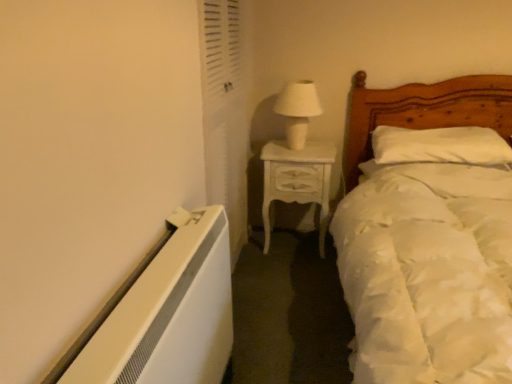
You are a GUI agent. You are given a task and a screenshot of the screen. Output one action in this format:
    pyautogui.click(x=<x>, y=<y>)
    Task: Click on the white glossy nightstand at center
    
    Given the screenshot: What is the action you would take?
    point(297,181)

Identify the location of white soft pillow at center. (440, 146).

At what (x,y) coordinates should I click in order to perform the action: click on white glossy nightstand at center. Please return your answer as a coordinate pair (x, y). Looking at the image, I should click on (297, 181).

Is white textured screen door at upper left to the right of white glossy nightstand at center from the viewer's perspective?

No, white textured screen door at upper left is not to the right of white glossy nightstand at center.

Consider the image. Would you say white textured screen door at upper left is inside or outside white glossy nightstand at center?

white textured screen door at upper left exists outside the volume of white glossy nightstand at center.

Which of these two, white textured screen door at upper left or white glossy nightstand at center, stands taller?

white textured screen door at upper left is taller.

At what (x,y) coordinates should I click in order to perform the action: click on nightstand on the right of white textured screen door at upper left. Please return your answer as a coordinate pair (x, y). The image size is (512, 384). Looking at the image, I should click on (297, 181).

Between white glossy nightstand at center and white textured screen door at upper left, which one has more height?

Standing taller between the two is white textured screen door at upper left.

Based on their sizes in the image, would you say white glossy nightstand at center is bigger or smaller than white textured screen door at upper left?

white glossy nightstand at center is bigger than white textured screen door at upper left.

Is white glossy nightstand at center closer to the viewer compared to white textured screen door at upper left?

No, the depth of white glossy nightstand at center is greater than that of white textured screen door at upper left.

Based on the photo, how different are the orientations of white glossy nightstand at center and white textured screen door at upper left in degrees?

88.4 degrees separate the facing orientations of white glossy nightstand at center and white textured screen door at upper left.

In the scene shown: Can you confirm if white textured screen door at upper left is wider than white soft pillow at center?

Incorrect, the width of white textured screen door at upper left does not surpass that of white soft pillow at center.

How different are the orientations of white textured screen door at upper left and white soft pillow at center in degrees?

89.2 degrees separate the facing orientations of white textured screen door at upper left and white soft pillow at center.

Is white textured screen door at upper left to the left or to the right of white soft pillow at center in the image?

From the image, it's evident that white textured screen door at upper left is to the left of white soft pillow at center.

Is white textured screen door at upper left outside of white soft pillow at center?

white textured screen door at upper left lies outside white soft pillow at center's area.

Is white satin bed at right at the back of white textured screen door at upper left?

No, white textured screen door at upper left is not facing the opposite direction of white satin bed at right.

From the image's perspective, which one is positioned higher, white textured screen door at upper left or white satin bed at right?

white textured screen door at upper left, from the image's perspective.

Does white textured screen door at upper left appear on the right side of white satin bed at right?

No.

Considering the points (231, 47) and (472, 146), which point is in front, point (231, 47) or point (472, 146)?

The point (231, 47) is more forward.

Who is shorter, white soft pillow at center or white satin bed at right?

Standing shorter between the two is white soft pillow at center.

Is white soft pillow at center beside white satin bed at right?

They are not placed beside each other.

Which is in front, white soft pillow at center or white satin bed at right?

Positioned in front is white satin bed at right.

Where is `bed that is under the white soft pillow at center (from a real-world perspective)`? bed that is under the white soft pillow at center (from a real-world perspective) is located at coordinates (428, 239).

Which object is positioned more to the right, white satin bed at right or white ceramic table lamp at upper center?

white satin bed at right.

Based on the photo, would you consider white satin bed at right to be distant from white ceramic table lamp at upper center?

Actually, white satin bed at right and white ceramic table lamp at upper center are a little close together.

Considering the sizes of objects white satin bed at right and white ceramic table lamp at upper center in the image provided, who is smaller, white satin bed at right or white ceramic table lamp at upper center?

With smaller size is white ceramic table lamp at upper center.

Is white satin bed at right in front of white ceramic table lamp at upper center?

Yes, it is.

Which of these two, white glossy nightstand at center or white ceramic table lamp at upper center, is smaller?

white ceramic table lamp at upper center.

How different are the orientations of white glossy nightstand at center and white ceramic table lamp at upper center in degrees?

The facing directions of white glossy nightstand at center and white ceramic table lamp at upper center are 5.86 degrees apart.

Is white glossy nightstand at center oriented away from white ceramic table lamp at upper center?

No, white glossy nightstand at center's orientation is not away from white ceramic table lamp at upper center.

Considering the positions of point (310, 173) and point (296, 103), is point (310, 173) closer or farther from the camera than point (296, 103)?

Point (310, 173) appears to be farther away from the viewer than point (296, 103).

The height and width of the screenshot is (384, 512). What are the coordinates of `screen door above the white glossy nightstand at center (from a real-world perspective)` in the screenshot? It's located at (225, 112).

Find the location of a particular element. The height and width of the screenshot is (384, 512). screen door to the left of white glossy nightstand at center is located at coordinates (225, 112).

Estimate the real-world distances between objects in this image. Which object is closer to white glossy nightstand at center, white satin bed at right or white ceramic table lamp at upper center?

white ceramic table lamp at upper center lies closer to white glossy nightstand at center than the other object.

Estimate the real-world distances between objects in this image. Which object is closer to white satin bed at right, white ceramic table lamp at upper center or white soft pillow at center?

white soft pillow at center.

From the image, which object appears to be nearer to white ceramic table lamp at upper center, white satin bed at right or white glossy nightstand at center?

Among the two, white glossy nightstand at center is located nearer to white ceramic table lamp at upper center.

Looking at the image, which one is located further to white ceramic table lamp at upper center, white satin bed at right or white soft pillow at center?

Based on the image, white satin bed at right appears to be further to white ceramic table lamp at upper center.

From the image, which object appears to be nearer to white soft pillow at center, white textured screen door at upper left or white satin bed at right?

white satin bed at right is closer to white soft pillow at center.

Estimate the real-world distances between objects in this image. Which object is closer to white glossy nightstand at center, white satin bed at right or white textured screen door at upper left?

Based on the image, white textured screen door at upper left appears to be nearer to white glossy nightstand at center.

Considering their positions, is white textured screen door at upper left positioned closer to white soft pillow at center than white glossy nightstand at center?

The object closer to white soft pillow at center is white glossy nightstand at center.

When comparing their distances from white textured screen door at upper left, does white ceramic table lamp at upper center or white soft pillow at center seem further?

white soft pillow at center is further to white textured screen door at upper left.

Image resolution: width=512 pixels, height=384 pixels. Find the location of `screen door positioned between white satin bed at right and white glossy nightstand at center from near to far`. screen door positioned between white satin bed at right and white glossy nightstand at center from near to far is located at coordinates (x=225, y=112).

This screenshot has width=512, height=384. Identify the location of nightstand situated between white ceramic table lamp at upper center and white soft pillow at center from left to right. (297, 181).

Image resolution: width=512 pixels, height=384 pixels. What are the coordinates of `table lamp between white satin bed at right and white glossy nightstand at center from front to back` in the screenshot? It's located at (298, 110).

Find the location of a particular element. table lamp between white textured screen door at upper left and white soft pillow at center from left to right is located at coordinates (298, 110).